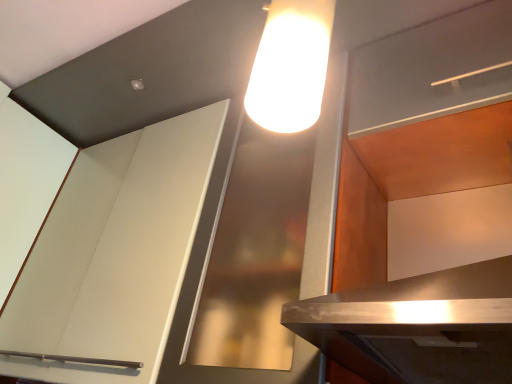
Question: Relative to matte wood shelf at upper right, is matte white cabinet at upper right, which is counted as the second cabinetry, starting from the left, in front or behind?

Choices:
 (A) behind
 (B) front

Answer: (B)

Question: Based on their positions, is matte white cabinet at upper right, which is counted as the second cabinetry, starting from the left, located to the left or right of matte wood shelf at upper right?

Choices:
 (A) left
 (B) right

Answer: (A)

Question: Which of these objects is positioned closest to the matte white cabinet at upper right, which ranks as the first cabinetry in right-to-left order?

Choices:
 (A) white matte cabinet at upper left, marked as the 1th cabinetry in a left-to-right arrangement
 (B) matte wood shelf at upper right

Answer: (B)

Question: Which object is the farthest from the matte white cabinet at upper right, which ranks as the first cabinetry in right-to-left order?

Choices:
 (A) matte wood shelf at upper right
 (B) white matte cabinet at upper left, marked as the 1th cabinetry in a left-to-right arrangement

Answer: (B)